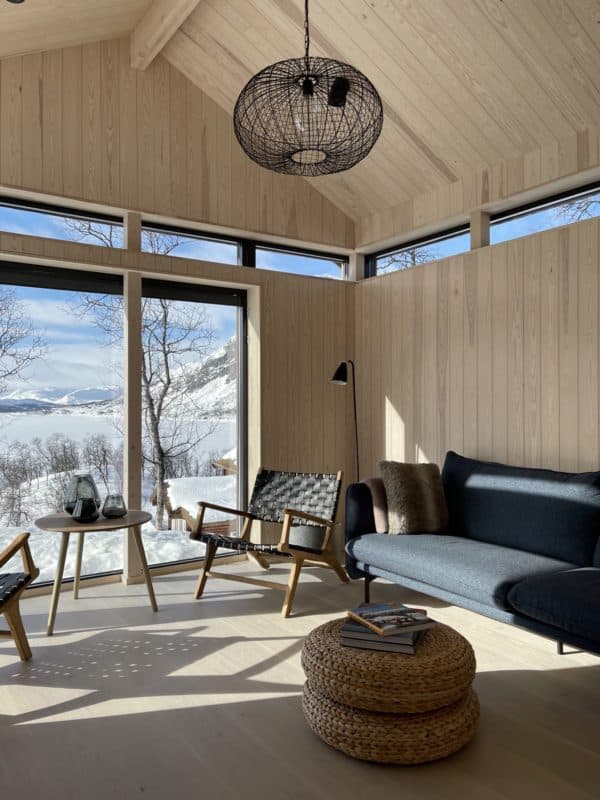
Find the location of a particular element. The image size is (600, 800). chair is located at coordinates (319, 497).